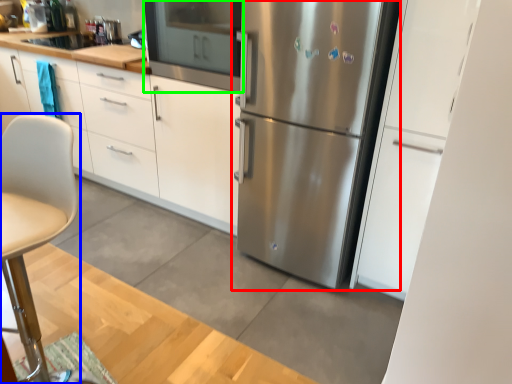
Question: Estimate the real-world distances between objects in this image. Which object is closer to refrigerator (highlighted by a red box), chair (highlighted by a blue box) or oven (highlighted by a green box)?

Choices:
 (A) chair
 (B) oven

Answer: (B)